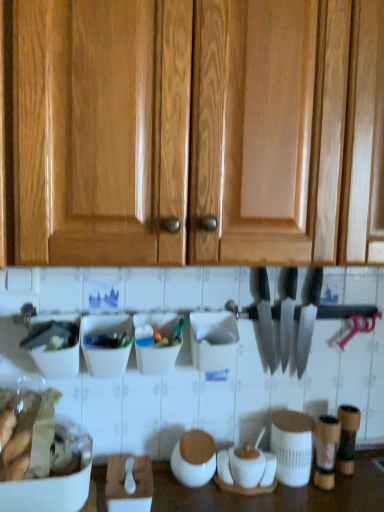
Question: Which direction should I rotate to face polished silver knife at center, which is counted as the 2th knife, starting from the left, — up or down?

Choices:
 (A) up
 (B) down

Answer: (B)

Question: Is polished silver knife at center, the 1th knife viewed from the left, thinner than polished silver knife at center, marked as the 1th knife in a right-to-left arrangement?

Choices:
 (A) yes
 (B) no

Answer: (B)

Question: Considering the relative sizes of polished silver knife at center, the 2th knife in the right-to-left sequence, and polished silver knife at center, which is counted as the 2th knife, starting from the left, in the image provided, is polished silver knife at center, the 2th knife in the right-to-left sequence, bigger than polished silver knife at center, which is counted as the 2th knife, starting from the left,?

Choices:
 (A) no
 (B) yes

Answer: (B)

Question: Is polished silver knife at center, the 1th knife viewed from the left, smaller than polished silver knife at center, marked as the 1th knife in a right-to-left arrangement?

Choices:
 (A) no
 (B) yes

Answer: (A)

Question: Could you tell me if polished silver knife at center, the 2th knife in the right-to-left sequence, is turned towards polished silver knife at center, which is counted as the 2th knife, starting from the left?

Choices:
 (A) no
 (B) yes

Answer: (A)

Question: Is polished silver knife at center, the 2th knife in the right-to-left sequence, not near polished silver knife at center, which is counted as the 2th knife, starting from the left?

Choices:
 (A) no
 (B) yes

Answer: (A)

Question: From a real-world perspective, is polished silver knife at center, the 2th knife in the right-to-left sequence, on polished silver knife at center, marked as the 1th knife in a right-to-left arrangement?

Choices:
 (A) yes
 (B) no

Answer: (A)

Question: Is white matte jar at center, the 1th appliance viewed from the left, smaller than polished silver knife at center, the 1th knife viewed from the left?

Choices:
 (A) yes
 (B) no

Answer: (A)

Question: Does white matte jar at center, which is the second appliance in right-to-left order, have a greater width compared to polished silver knife at center, the 2th knife in the right-to-left sequence?

Choices:
 (A) yes
 (B) no

Answer: (B)

Question: From a real-world perspective, does white matte jar at center, the 1th appliance viewed from the left, stand above polished silver knife at center, the 2th knife in the right-to-left sequence?

Choices:
 (A) yes
 (B) no

Answer: (B)

Question: Is white matte jar at center, the 1th appliance viewed from the left, to the left of polished silver knife at center, the 2th knife in the right-to-left sequence, from the viewer's perspective?

Choices:
 (A) no
 (B) yes

Answer: (B)

Question: Is white matte jar at center, which is the second appliance in right-to-left order, far from polished silver knife at center, the 2th knife in the right-to-left sequence?

Choices:
 (A) yes
 (B) no

Answer: (B)

Question: From the image's perspective, is white matte jar at center, which is the second appliance in right-to-left order, above polished silver knife at center, the 2th knife in the right-to-left sequence?

Choices:
 (A) yes
 (B) no

Answer: (B)

Question: Does white matte jar at center, which is the second appliance in right-to-left order, have a lesser width compared to white matte jar at center, the first appliance when ordered from right to left?

Choices:
 (A) yes
 (B) no

Answer: (B)